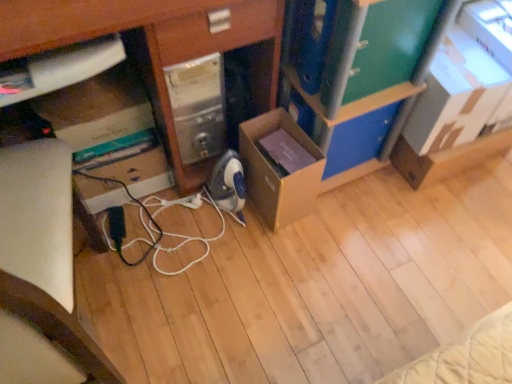
The width and height of the screenshot is (512, 384). I want to click on blue plastic drawer at center, the first drawer from the back, so click(x=359, y=139).

In order to face blue plastic drawer at center, which ranks as the second drawer in top-to-bottom order, should I rotate leftwards or rightwards?

You should look right and rotate roughly 13.026 degrees.

At what (x,y) coordinates should I click in order to perform the action: click on matte cardboard box at lower left. Please return your answer as a coordinate pair (x, y). Looking at the image, I should click on (157, 45).

Describe the element at coordinates (456, 95) in the screenshot. I see `cardboard box at upper right, which appears as the second cardboard box when viewed from the left` at that location.

You are a GUI agent. You are given a task and a screenshot of the screen. Output one action in this format:
    pyautogui.click(x=<x>, y=<y>)
    Task: Click on the green matte drawer at upper right, arranged as the second drawer when viewed from the back
    
    Given the screenshot: What is the action you would take?
    pyautogui.click(x=390, y=45)

Describe the element at coordinates (390, 45) in the screenshot. I see `green matte drawer at upper right, arranged as the second drawer when viewed from the back` at that location.

Find the location of a particular element. The image size is (512, 384). brown cardboard box at center, positioned as the second cardboard box in right-to-left order is located at coordinates (280, 167).

From their relative heights in the image, would you say blue plastic drawer at center, the first drawer from the back, is taller or shorter than black rubber cable at center?

In the image, blue plastic drawer at center, the first drawer from the back, appears to be taller than black rubber cable at center.

Can you confirm if blue plastic drawer at center, the first drawer from the back, is wider than black rubber cable at center?

In fact, blue plastic drawer at center, the first drawer from the back, might be narrower than black rubber cable at center.

Is blue plastic drawer at center, the second drawer from the front, positioned beyond the bounds of black rubber cable at center?

Yes.

Is blue plastic drawer at center, which is the 1th drawer in bottom-to-top order, at the left side of black rubber cable at center?

No.

Is green matte bookshelf at upper right surrounding cardboard box at upper right, which appears as the second cardboard box when viewed from the left?

No, cardboard box at upper right, which appears as the second cardboard box when viewed from the left, is not inside green matte bookshelf at upper right.

This screenshot has height=384, width=512. What are the coordinates of `cardboard box on the right side of green matte bookshelf at upper right` in the screenshot? It's located at (456, 95).

Considering the positions of objects green matte bookshelf at upper right and cardboard box at upper right, the first cardboard box from the right, in the image provided, who is more to the right, green matte bookshelf at upper right or cardboard box at upper right, the first cardboard box from the right,?

From the viewer's perspective, cardboard box at upper right, the first cardboard box from the right, appears more on the right side.

Is green matte bookshelf at upper right positioned far away from cardboard box at upper right, which appears as the second cardboard box when viewed from the left?

They are positioned close to each other.

Who is bigger, green matte drawer at upper right, which is the first drawer from front to back, or black rubber cable at center?

Bigger between the two is green matte drawer at upper right, which is the first drawer from front to back.

Does green matte drawer at upper right, the 1th drawer viewed from the top, come behind black rubber cable at center?

No, it is in front of black rubber cable at center.

Between green matte drawer at upper right, arranged as the second drawer when viewed from the back, and black rubber cable at center, which one appears on the left side from the viewer's perspective?

Positioned to the left is black rubber cable at center.

Which is farther from the camera, (389, 61) or (144, 226)?

The point (144, 226) is farther from the camera.

Are blue plastic drawer at center, which is the 1th drawer in bottom-to-top order, and green matte drawer at upper right, the 2th drawer when ordered from bottom to top, located far from each other?

Actually, blue plastic drawer at center, which is the 1th drawer in bottom-to-top order, and green matte drawer at upper right, the 2th drawer when ordered from bottom to top, are a little close together.

Considering the relative sizes of blue plastic drawer at center, which is the 1th drawer in bottom-to-top order, and green matte drawer at upper right, arranged as the second drawer when viewed from the back, in the image provided, is blue plastic drawer at center, which is the 1th drawer in bottom-to-top order, wider than green matte drawer at upper right, arranged as the second drawer when viewed from the back,?

Incorrect, the width of blue plastic drawer at center, which is the 1th drawer in bottom-to-top order, does not surpass that of green matte drawer at upper right, arranged as the second drawer when viewed from the back.

Does blue plastic drawer at center, the first drawer from the back, appear on the left side of green matte drawer at upper right, the 2th drawer when ordered from bottom to top?

No, blue plastic drawer at center, the first drawer from the back, is not to the left of green matte drawer at upper right, the 2th drawer when ordered from bottom to top.

Where is `drawer that appears above the blue plastic drawer at center, which is the 1th drawer in bottom-to-top order (from a real-world perspective)`? This screenshot has width=512, height=384. drawer that appears above the blue plastic drawer at center, which is the 1th drawer in bottom-to-top order (from a real-world perspective) is located at coordinates (390, 45).

Considering the sizes of blue plastic drawer at center, which is the 1th drawer in bottom-to-top order, and brown cardboard box at center, positioned as the second cardboard box in right-to-left order, in the image, is blue plastic drawer at center, which is the 1th drawer in bottom-to-top order, bigger or smaller than brown cardboard box at center, positioned as the second cardboard box in right-to-left order,?

blue plastic drawer at center, which is the 1th drawer in bottom-to-top order, is smaller than brown cardboard box at center, positioned as the second cardboard box in right-to-left order.

Based on the photo, can you tell me how much blue plastic drawer at center, the second drawer from the front, and brown cardboard box at center, the 1th cardboard box viewed from the left, differ in facing direction?

The angular difference between blue plastic drawer at center, the second drawer from the front, and brown cardboard box at center, the 1th cardboard box viewed from the left, is 0.00202 degrees.

You are a GUI agent. You are given a task and a screenshot of the screen. Output one action in this format:
    pyautogui.click(x=<x>, y=<y>)
    Task: Click on the cardboard box that is the 2nd one when counting forward from the blue plastic drawer at center, which ranks as the second drawer in top-to-bottom order
    This screenshot has height=384, width=512.
    Given the screenshot: What is the action you would take?
    pyautogui.click(x=280, y=167)

In the scene shown: Considering the sizes of blue plastic drawer at center, which is the 1th drawer in bottom-to-top order, and brown cardboard box at center, positioned as the second cardboard box in right-to-left order, in the image, is blue plastic drawer at center, which is the 1th drawer in bottom-to-top order, taller or shorter than brown cardboard box at center, positioned as the second cardboard box in right-to-left order,?

In the image, blue plastic drawer at center, which is the 1th drawer in bottom-to-top order, appears to be shorter than brown cardboard box at center, positioned as the second cardboard box in right-to-left order.

Between brown cardboard box at center, positioned as the second cardboard box in right-to-left order, and black rubber cable at center, which one has less height?

black rubber cable at center is shorter.

Could you tell me if brown cardboard box at center, positioned as the second cardboard box in right-to-left order, is facing black rubber cable at center?

No, brown cardboard box at center, positioned as the second cardboard box in right-to-left order, is not facing towards black rubber cable at center.

Based on the photo, is matte cardboard box at lower left turned away from black rubber cable at center?

matte cardboard box at lower left is not turned away from black rubber cable at center.

Can black rubber cable at center be found inside matte cardboard box at lower left?

Yes, black rubber cable at center is inside matte cardboard box at lower left.

Consider the image. Which object is positioned more to the right, matte cardboard box at lower left or black rubber cable at center?

From the viewer's perspective, black rubber cable at center appears more on the right side.

Find the location of a particular element. desk that appears in front of the black rubber cable at center is located at coordinates (157, 45).

Where is `the 1st drawer positioned above the black rubber cable at center (from a real-world perspective)`? The width and height of the screenshot is (512, 384). the 1st drawer positioned above the black rubber cable at center (from a real-world perspective) is located at coordinates (359, 139).

The width and height of the screenshot is (512, 384). In order to click on cardboard box located on the right of green matte bookshelf at upper right in this screenshot , I will do `click(456, 95)`.

When comparing their distances from blue plastic drawer at center, which ranks as the second drawer in top-to-bottom order, does green matte drawer at upper right, arranged as the second drawer when viewed from the back, or matte cardboard box at lower left seem closer?

green matte drawer at upper right, arranged as the second drawer when viewed from the back, is closer to blue plastic drawer at center, which ranks as the second drawer in top-to-bottom order.

From the image, which object appears to be nearer to matte cardboard box at lower left, green matte drawer at upper right, the 2th drawer when ordered from bottom to top, or black rubber cable at center?

green matte drawer at upper right, the 2th drawer when ordered from bottom to top, is closer to matte cardboard box at lower left.

When comparing their distances from cardboard box at upper right, the first cardboard box from the right, does brown cardboard box at center, positioned as the second cardboard box in right-to-left order, or green matte bookshelf at upper right seem further?

brown cardboard box at center, positioned as the second cardboard box in right-to-left order, lies further to cardboard box at upper right, the first cardboard box from the right, than the other object.

When comparing their distances from black rubber cable at center, does brown cardboard box at center, positioned as the second cardboard box in right-to-left order, or blue plastic drawer at center, which is the 1th drawer in bottom-to-top order, seem further?

The object further to black rubber cable at center is blue plastic drawer at center, which is the 1th drawer in bottom-to-top order.

Looking at the image, which one is located closer to brown cardboard box at center, positioned as the second cardboard box in right-to-left order, green matte drawer at upper right, the 1th drawer viewed from the top, or cardboard box at upper right, the first cardboard box from the right?

green matte drawer at upper right, the 1th drawer viewed from the top, is positioned closer to the anchor brown cardboard box at center, positioned as the second cardboard box in right-to-left order.

Looking at the image, which one is located closer to brown cardboard box at center, the 1th cardboard box viewed from the left, green matte drawer at upper right, arranged as the second drawer when viewed from the back, or black rubber cable at center?

black rubber cable at center.

Based on their spatial positions, is blue plastic drawer at center, the second drawer from the front, or green matte drawer at upper right, arranged as the second drawer when viewed from the back, further from matte cardboard box at lower left?

blue plastic drawer at center, the second drawer from the front, is further to matte cardboard box at lower left.

Looking at the image, which one is located further to brown cardboard box at center, positioned as the second cardboard box in right-to-left order, black rubber cable at center or blue plastic drawer at center, the second drawer from the front?

black rubber cable at center.

Identify the location of bookshelf located between black rubber cable at center and green matte drawer at upper right, the 2th drawer when ordered from bottom to top, in the left-right direction. (362, 74).

Where is `drawer situated between matte cardboard box at lower left and blue plastic drawer at center, which ranks as the second drawer in top-to-bottom order, from left to right`? drawer situated between matte cardboard box at lower left and blue plastic drawer at center, which ranks as the second drawer in top-to-bottom order, from left to right is located at coordinates (390, 45).

Where is `drawer between green matte drawer at upper right, which is the first drawer from front to back, and brown cardboard box at center, positioned as the second cardboard box in right-to-left order, from top to bottom`? This screenshot has height=384, width=512. drawer between green matte drawer at upper right, which is the first drawer from front to back, and brown cardboard box at center, positioned as the second cardboard box in right-to-left order, from top to bottom is located at coordinates (359, 139).

This screenshot has width=512, height=384. I want to click on bookshelf between brown cardboard box at center, the 1th cardboard box viewed from the left, and cardboard box at upper right, the first cardboard box from the right, so click(362, 74).